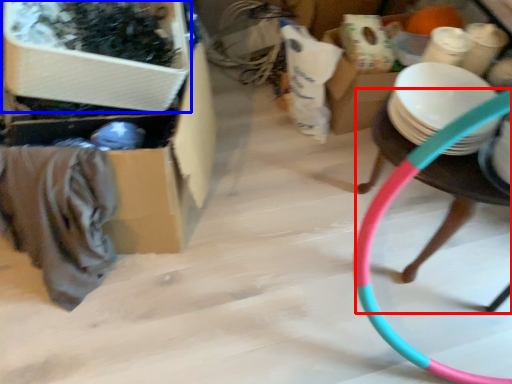
Question: Among these objects, which one is nearest to the camera, chair (highlighted by a red box) or storage box (highlighted by a blue box)?

Choices:
 (A) chair
 (B) storage box

Answer: (B)